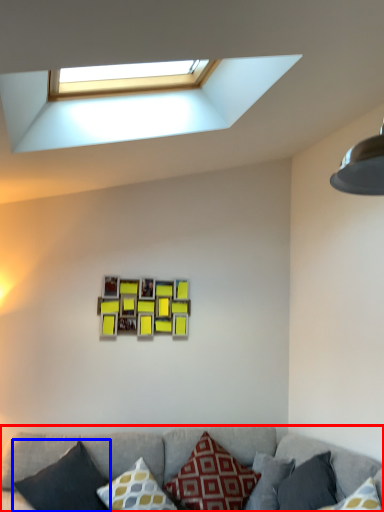
Question: Which of the following is the farthest to the observer, studio couch (highlighted by a red box) or pillow (highlighted by a blue box)?

Choices:
 (A) studio couch
 (B) pillow

Answer: (B)